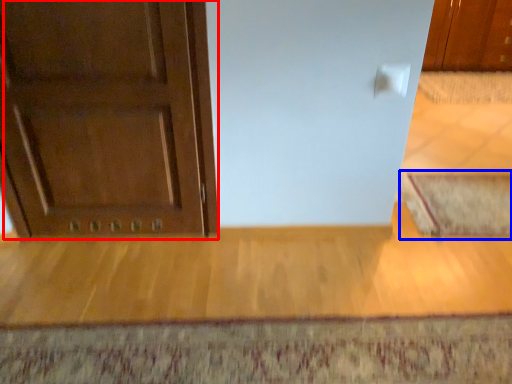
Question: Which object is further to the camera taking this photo, door (highlighted by a red box) or doormat (highlighted by a blue box)?

Choices:
 (A) door
 (B) doormat

Answer: (B)